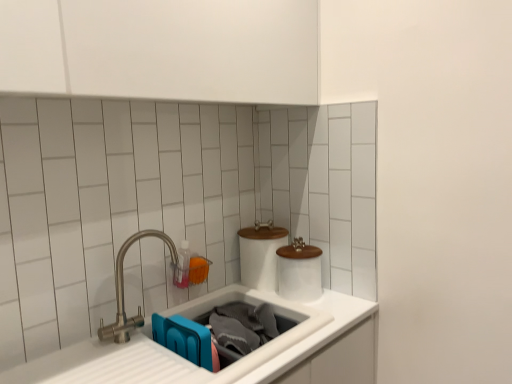
Find the location of a particular element. This screenshot has width=512, height=384. free space on the front side of brushed metal faucet at left is located at coordinates (156, 354).